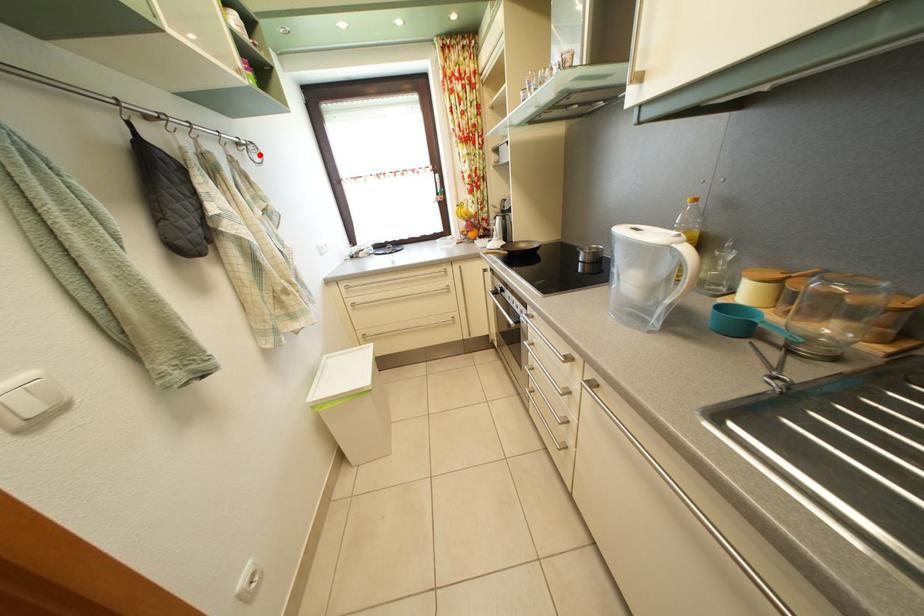
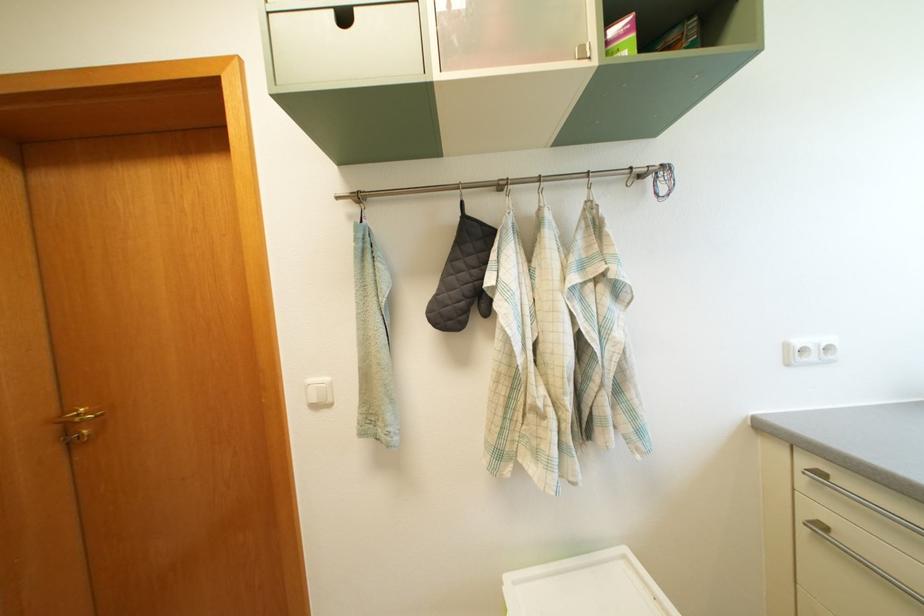
Find the pixel in the second image that matches the highlighted location in the first image.

(669, 180)